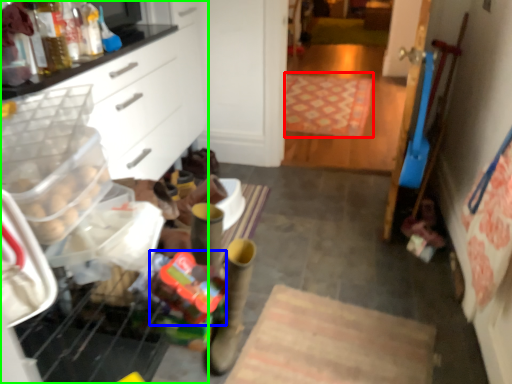
Question: Which object is positioned farthest from mat (highlighted by a red box)? Select from stuff (highlighted by a blue box) and cabinetry (highlighted by a green box).

Choices:
 (A) stuff
 (B) cabinetry

Answer: (A)